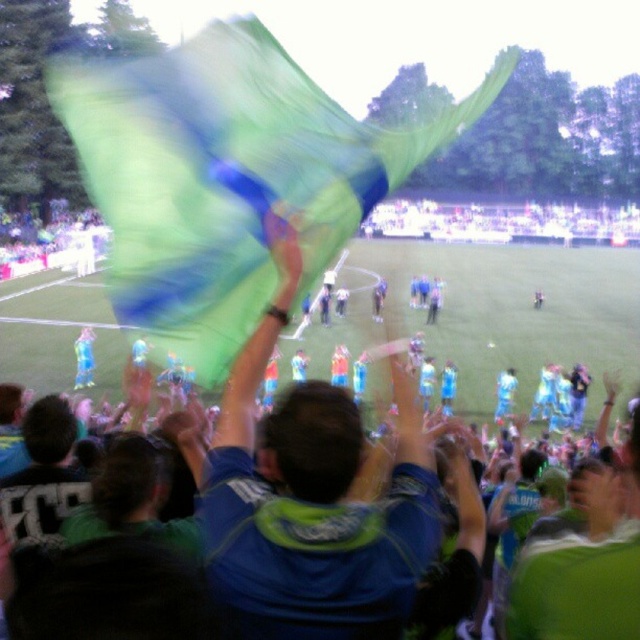
Between point (429, 557) and point (298, 346), which one is positioned behind?

The point (298, 346) is more distant.

Between point (346, 525) and point (458, 340), which one is positioned in front?

Positioned in front is point (346, 525).

The image size is (640, 640). What do you see at coordinates (312, 499) in the screenshot?
I see `blue fabric at center` at bounding box center [312, 499].

Identify the location of blue fabric at center. The image size is (640, 640). (312, 499).